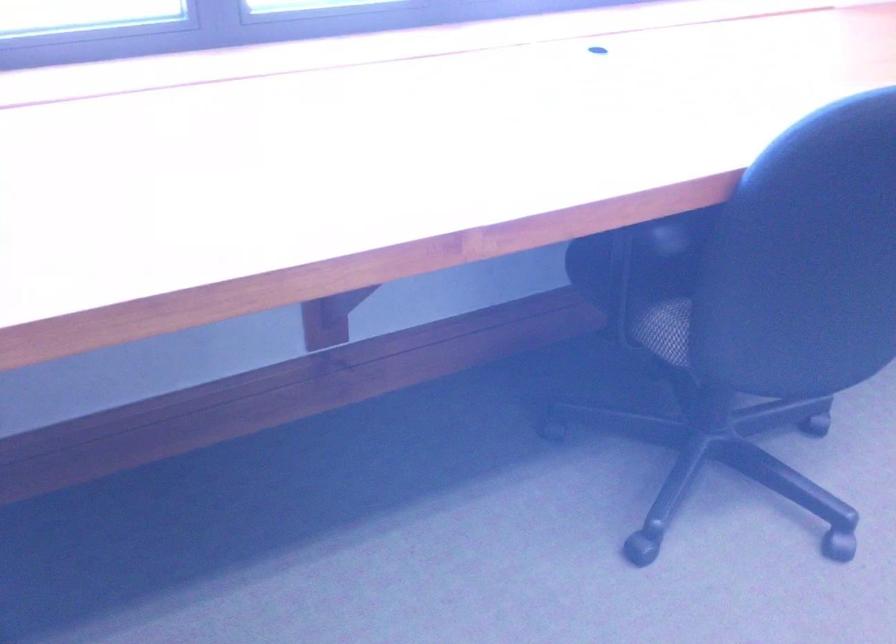
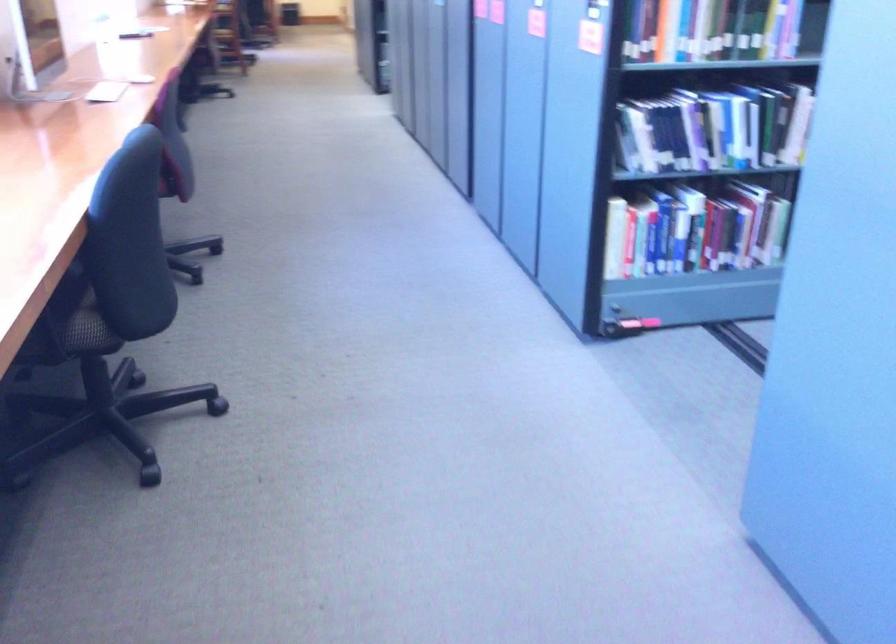
The point at [640,310] is marked in the first image. Where is the corresponding point in the second image?

(73, 324)